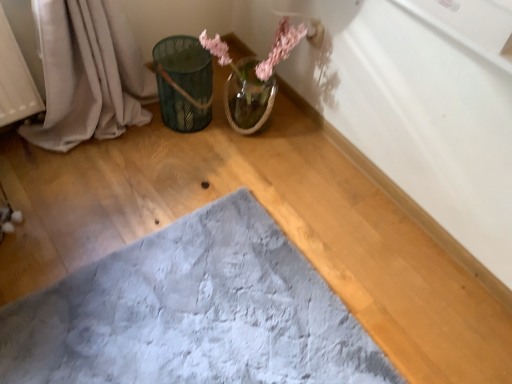
At what (x,y) coordinates should I click in order to perform the action: click on free location in front of green metallic bucket at upper left. Please return your answer as a coordinate pair (x, y). The width and height of the screenshot is (512, 384). Looking at the image, I should click on (175, 158).